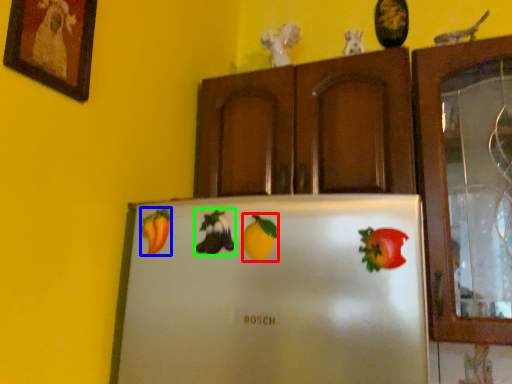
Question: Which is farther away from fruit (highlighted by a red box)? fruit (highlighted by a blue box) or fruit (highlighted by a green box)?

Choices:
 (A) fruit
 (B) fruit

Answer: (A)